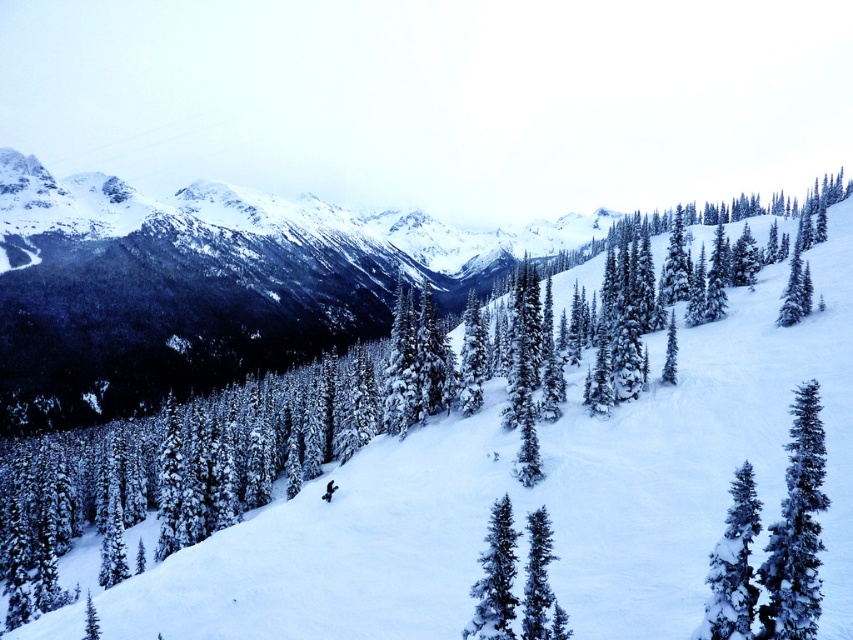
Is green matte evergreen at center bigger than snow-covered evergreen at lower right?

Indeed, green matte evergreen at center has a larger size compared to snow-covered evergreen at lower right.

Does point (270, 540) come farther from viewer compared to point (802, 492)?

Yes, point (270, 540) is behind point (802, 492).

This screenshot has width=853, height=640. Identify the location of green matte evergreen at center. (534, 499).

Image resolution: width=853 pixels, height=640 pixels. I want to click on green matte evergreen at center, so click(x=534, y=499).

Identify the location of snow-covered evergreen at lower right. (796, 529).

Measure the distance between point (792, 528) and camera.

They are 33.37 meters apart.

The image size is (853, 640). What are the coordinates of `snow-covered evergreen at lower right` in the screenshot? It's located at (796, 529).

Is snow-covered evergreen at lower right below snow-covered evergreen at center-right?

No, snow-covered evergreen at lower right is not below snow-covered evergreen at center-right.

Who is positioned more to the left, snow-covered evergreen at lower right or snow-covered evergreen at center-right?

Positioned to the left is snow-covered evergreen at center-right.

The height and width of the screenshot is (640, 853). I want to click on snow-covered evergreen at lower right, so click(x=796, y=529).